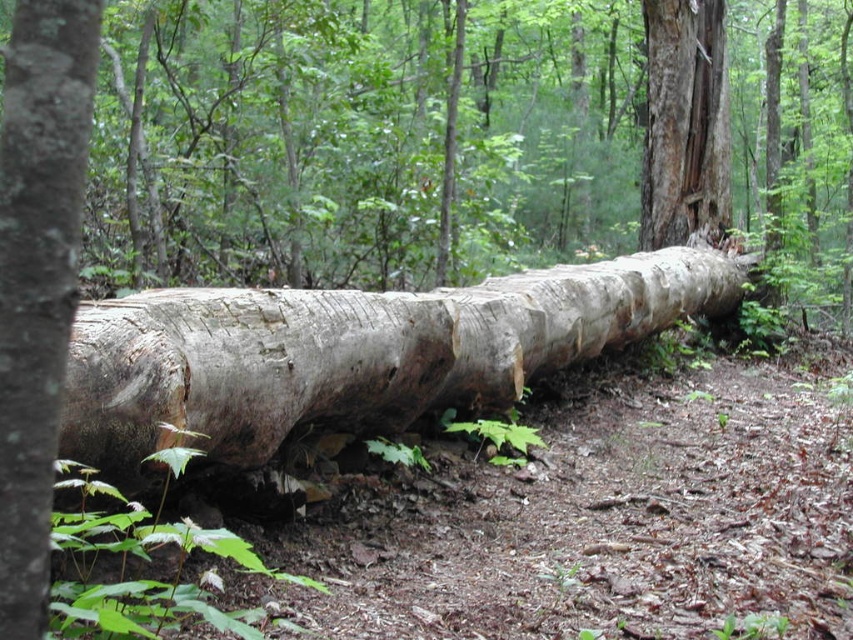
Is point (96, 440) more distant than point (654, 144)?

No.

Who is positioned more to the left, natural wood log at center or gray rough bark tree trunk at center?

Positioned to the left is natural wood log at center.

The width and height of the screenshot is (853, 640). In order to click on natural wood log at center in this screenshot , I will do `click(352, 353)`.

Who is taller, natural wood log at center or smooth bark log at center?

Standing taller between the two is natural wood log at center.

Does natural wood log at center have a greater height compared to smooth bark log at center?

Yes.

Is point (126, 451) closer to viewer compared to point (45, 490)?

No, it is behind (45, 490).

Image resolution: width=853 pixels, height=640 pixels. What are the coordinates of `natural wood log at center` in the screenshot? It's located at (352, 353).

Does smooth bark log at center have a greater height compared to gray rough bark tree trunk at center?

No, smooth bark log at center is not taller than gray rough bark tree trunk at center.

Can you confirm if smooth bark log at center is bigger than gray rough bark tree trunk at center?

No.

Is point (28, 342) positioned behind point (683, 157)?

No, it is not.

Find the location of a particular element. The width and height of the screenshot is (853, 640). smooth bark log at center is located at coordinates (38, 276).